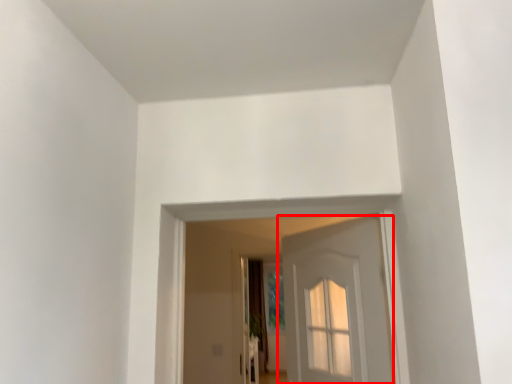
Question: Considering the relative positions of door (annotated by the red box) and curtain in the image provided, where is door (annotated by the red box) located with respect to the staircase?

Choices:
 (A) right
 (B) left

Answer: (A)